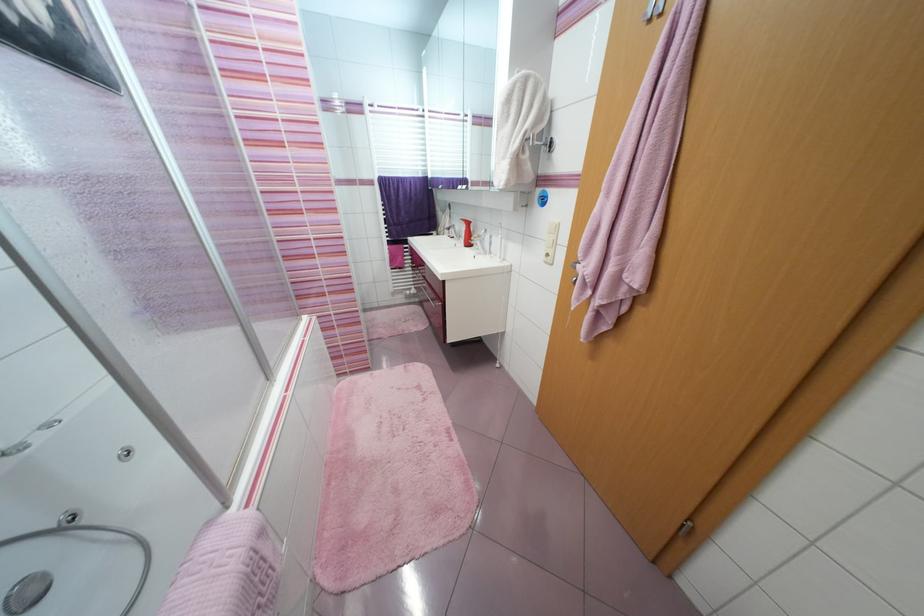
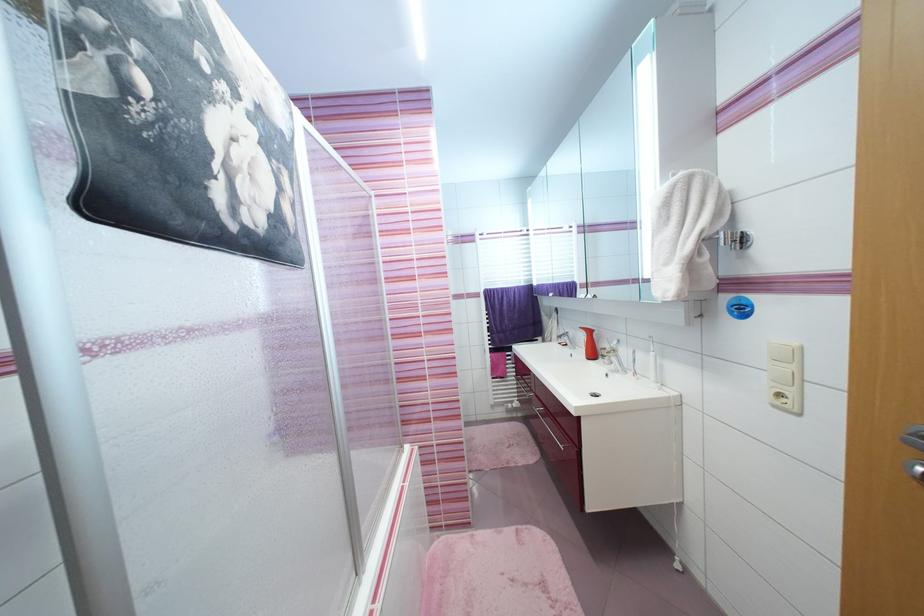
How did the camera likely rotate?

The camera rotated toward left-up.